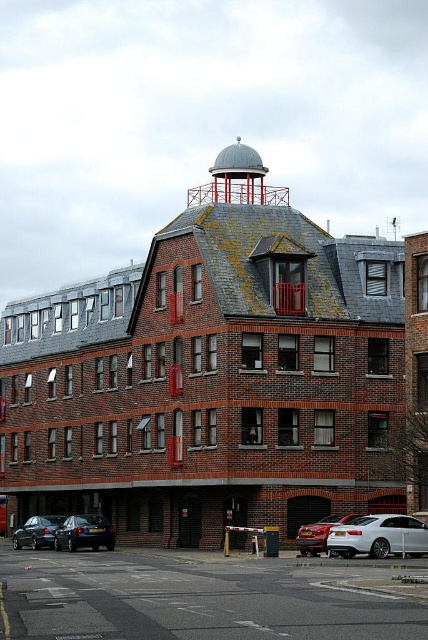
Question: Which object is the farthest from the satin silver car at lower right?

Choices:
 (A) shiny black sedan at lower left
 (B) shiny black car at lower left

Answer: (A)

Question: Does shiny black car at lower left appear under satin silver car at lower right?

Choices:
 (A) no
 (B) yes

Answer: (B)

Question: Is silver metallic sedan at lower right bigger than shiny black sedan at lower left?

Choices:
 (A) no
 (B) yes

Answer: (A)

Question: Which of the following is the closest to the observer?

Choices:
 (A) (427, 525)
 (B) (59, 522)
 (C) (318, 518)
 (D) (68, 525)

Answer: (A)

Question: Among these points, which one is farthest from the camera?

Choices:
 (A) (32, 531)
 (B) (317, 534)
 (C) (67, 540)
 (D) (388, 515)

Answer: (A)

Question: Does shiny black sedan at lower left have a greater width compared to satin silver car at lower right?

Choices:
 (A) yes
 (B) no

Answer: (A)